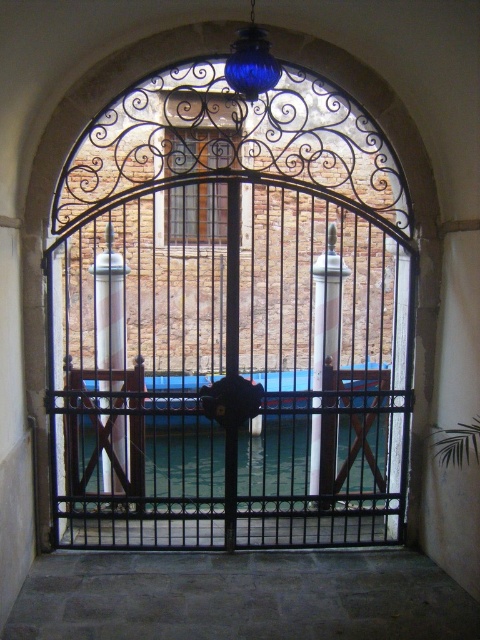
You are a delivery robot with a width of 1 meter. You need to pass through the space between the black metal gate at center and the clear glass water at center. Can you fit through the space?

The distance between the black metal gate at center and the clear glass water at center is 1.36 meters. Since the robot is 1 meter wide, it can fit through the space as the distance is wider than the robot.

You are an architect designing a model of this scene. You have a 10cm wide space to place both the black metal gate at center and the clear glass water at center. Which object should you place first to ensure they both fit?

The black metal gate at center is thinner than clear glass water at center, so you should place the black metal gate at center first to ensure both fit within the 10cm space.

You are standing in front of the arched doorway. There is a black metal gate at center. Where is the black metal gate at center located in relation to the point marked at coordinates (229, 321)?

The black metal gate at center is exactly at the point marked at coordinates (229, 321).